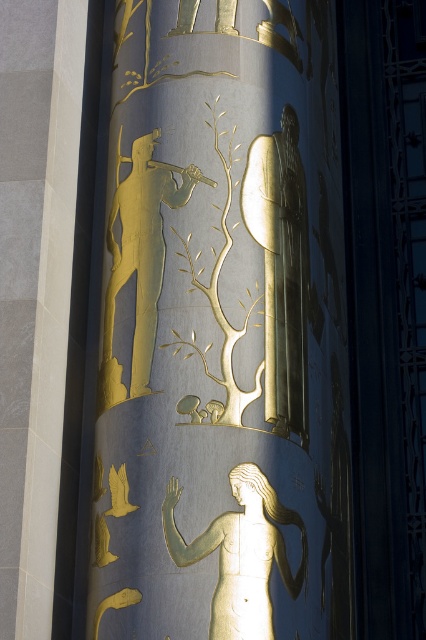
You are an architect examining the decorative panel. You notice two points marked on the panel at coordinates point (158, 488) and point (270, 506). Which point is closer to the viewer?

Point (158, 488) is in front of point (270, 506), so it is closer to the viewer.

Looking at the decorative panel described, which object is taller between the gold metallic relief at center and the gold metallic figure at center?

The gold metallic relief at center is taller than the gold metallic figure at center.